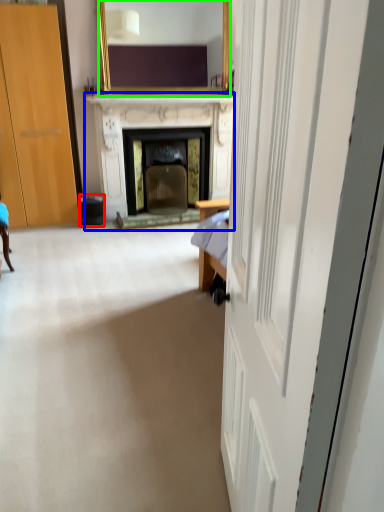
Question: Based on their relative distances, which object is nearer to trash bin/can (highlighted by a red box)? Choose from fireplace (highlighted by a blue box) and mirror (highlighted by a green box).

Choices:
 (A) fireplace
 (B) mirror

Answer: (A)